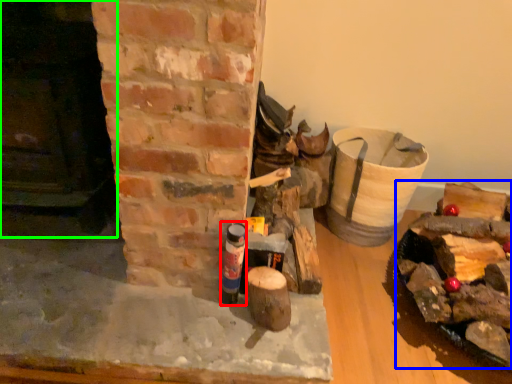
Question: Based on their relative distances, which object is farther from bottle (highlighted by a red box)? Choose from debris (highlighted by a blue box) and fireplace (highlighted by a green box).

Choices:
 (A) debris
 (B) fireplace

Answer: (A)